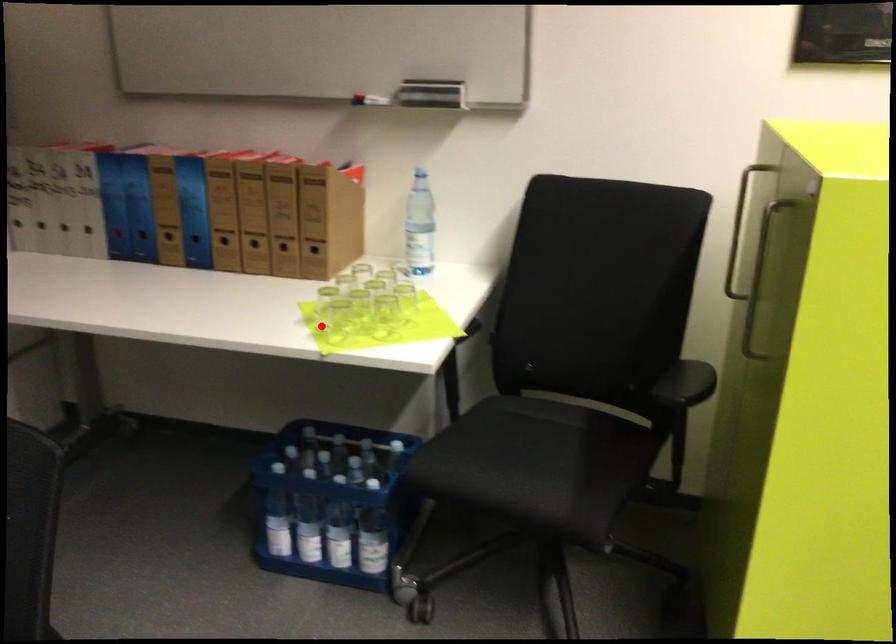
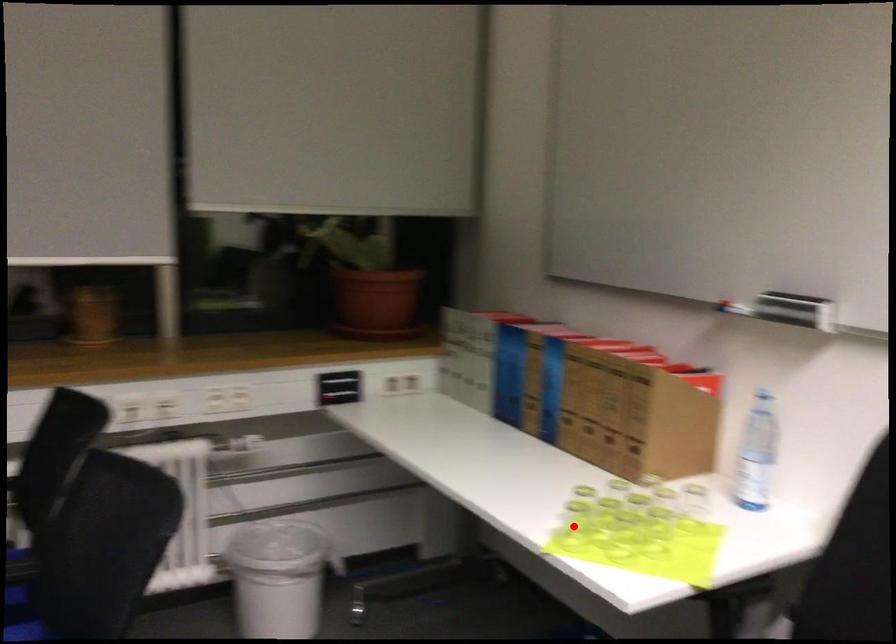
I am providing you with two images of the same scene from different viewpoints. A red point is marked on the first image and another point is marked on the second image. Do the highlighted points in image1 and image2 indicate the same real-world spot?

Yes